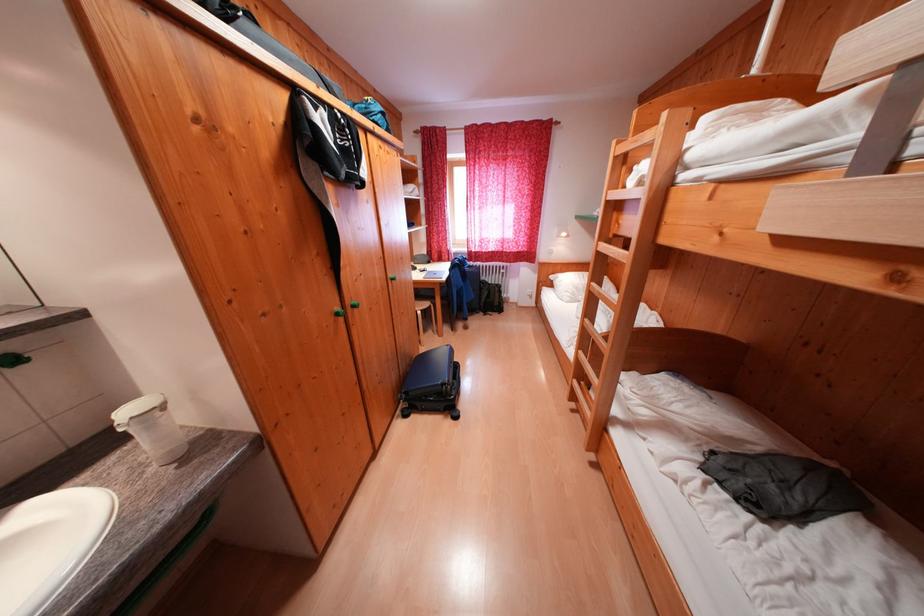
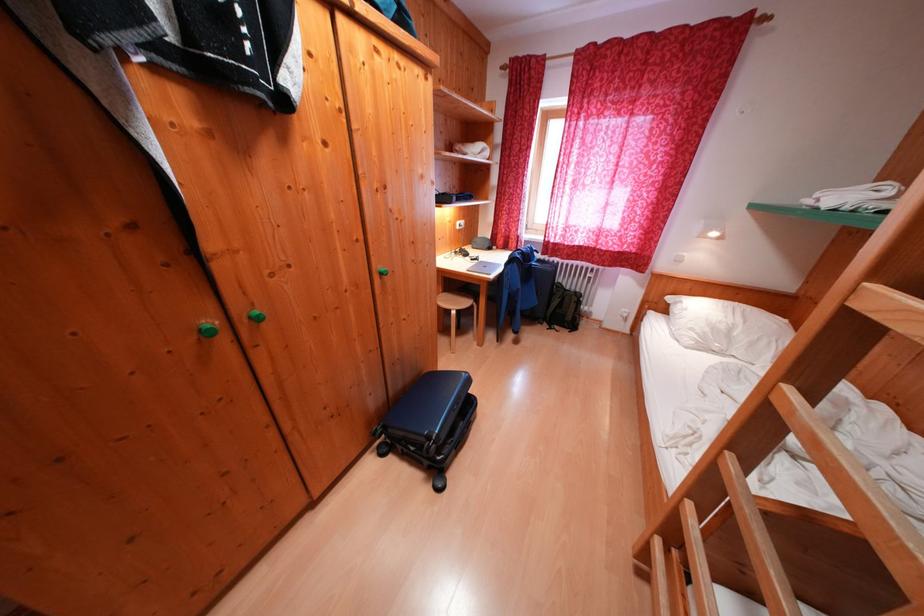
Question: The first image is from the beginning of the video and the second image is from the end. How did the camera likely rotate when shooting the video?

Choices:
 (A) Left
 (B) Right
 (C) Up
 (D) Down

Answer: (A)